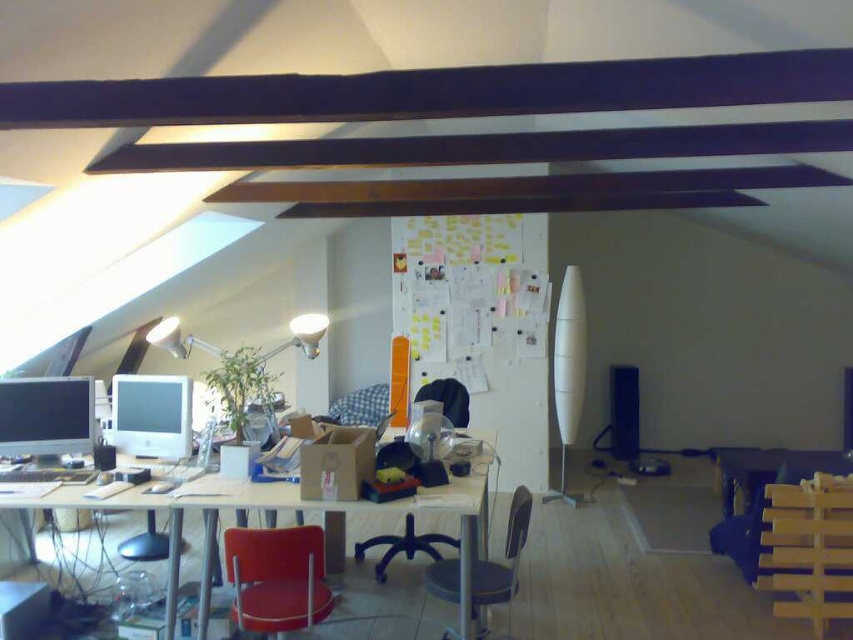
Question: Among these points, which one is nearest to the camera?

Choices:
 (A) (376, 541)
 (B) (9, 433)
 (C) (262, 580)
 (D) (140, 400)

Answer: (C)

Question: Which of the following is the farthest from the observer?

Choices:
 (A) (428, 536)
 (B) (486, 577)
 (C) (141, 406)
 (D) (303, 611)

Answer: (A)

Question: In this image, where is matte black monitor at left located relative to metallic gray chair at center?

Choices:
 (A) right
 (B) left

Answer: (B)

Question: Is velvet red chair at center positioned before matte black monitor at left?

Choices:
 (A) no
 (B) yes

Answer: (B)

Question: Which of the following is the closest to the observer?

Choices:
 (A) velvet red chair at center
 (B) white glossy computer monitor at center

Answer: (A)

Question: Is the position of white glossy computer desk at center more distant than that of matte black monitor at left?

Choices:
 (A) yes
 (B) no

Answer: (B)